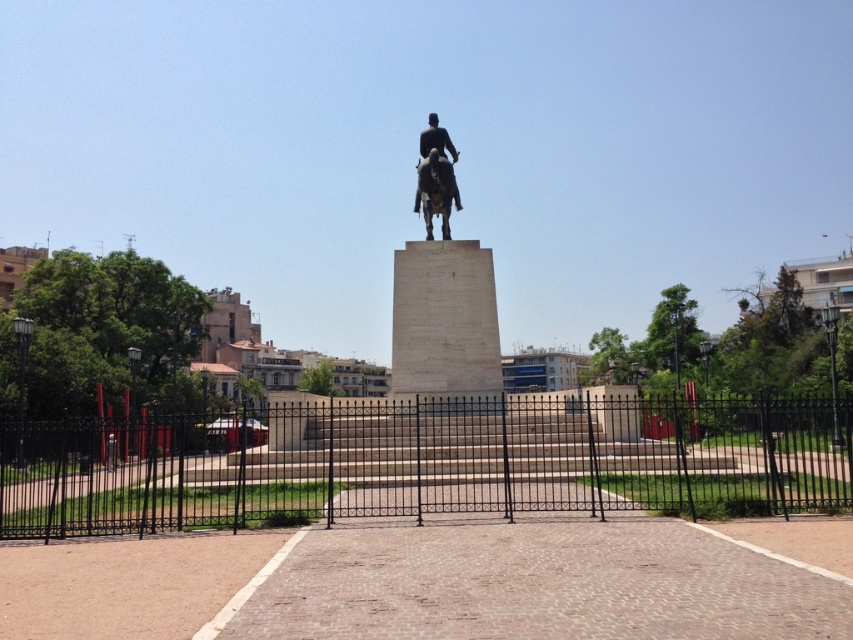
Question: Can you confirm if bronze metallic horse at center is wider than black polished statue at center?

Choices:
 (A) no
 (B) yes

Answer: (A)

Question: Which object is farther from the camera taking this photo?

Choices:
 (A) bronze metallic horse at center
 (B) bronze statue at center
 (C) black wrought iron fence at center
 (D) black polished statue at center

Answer: (D)

Question: Among these objects, which one is nearest to the camera?

Choices:
 (A) black polished statue at center
 (B) black wrought iron fence at center
 (C) bronze statue at center
 (D) bronze metallic horse at center

Answer: (B)

Question: Estimate the real-world distances between objects in this image. Which object is closer to the bronze statue at center?

Choices:
 (A) black wrought iron fence at center
 (B) bronze metallic horse at center
 (C) black polished statue at center

Answer: (C)

Question: Is the position of bronze metallic horse at center less distant than that of black polished statue at center?

Choices:
 (A) yes
 (B) no

Answer: (A)

Question: Can you confirm if black wrought iron fence at center is positioned to the left of black polished statue at center?

Choices:
 (A) no
 (B) yes

Answer: (A)